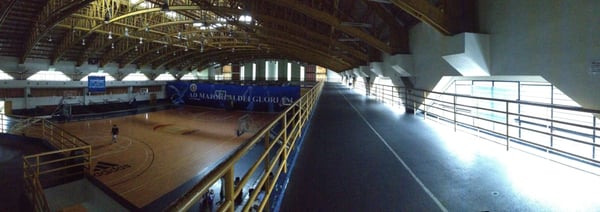
Identify the location of glass windows. (534, 93), (384, 80), (361, 82), (46, 75), (109, 79), (136, 76), (162, 76), (189, 77), (5, 77), (333, 75).